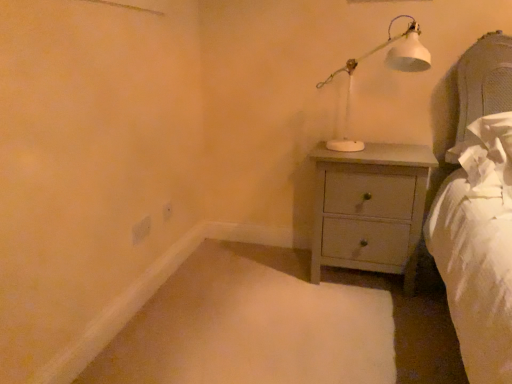
Question: From the image's perspective, is white matte table lamp at upper right beneath white plastic electric outlet at lower center, the 1th electric outlet from the back?

Choices:
 (A) no
 (B) yes

Answer: (A)

Question: Is white plastic electric outlet at lower center, the 1th electric outlet from the back, completely or partially inside white matte table lamp at upper right?

Choices:
 (A) no
 (B) yes

Answer: (A)

Question: Is white matte table lamp at upper right shorter than white plastic electric outlet at lower center, the 1th electric outlet viewed from the right?

Choices:
 (A) yes
 (B) no

Answer: (B)

Question: From a real-world perspective, is white matte table lamp at upper right positioned over white plastic electric outlet at lower center, the 1th electric outlet viewed from the right, based on gravity?

Choices:
 (A) no
 (B) yes

Answer: (B)

Question: Is white matte table lamp at upper right further to camera compared to white plastic electric outlet at lower center, the 1th electric outlet from the back?

Choices:
 (A) no
 (B) yes

Answer: (A)

Question: Does white matte table lamp at upper right have a lesser width compared to white plastic electric outlet at lower center, which is the second electric outlet in front-to-back order?

Choices:
 (A) yes
 (B) no

Answer: (B)

Question: Is light gray wood chest of drawers at center-right far away from white matte electric outlet at lower left, acting as the second electric outlet starting from the right?

Choices:
 (A) no
 (B) yes

Answer: (B)

Question: Considering the relative sizes of light gray wood chest of drawers at center-right and white matte electric outlet at lower left, acting as the second electric outlet starting from the right, in the image provided, is light gray wood chest of drawers at center-right shorter than white matte electric outlet at lower left, acting as the second electric outlet starting from the right,?

Choices:
 (A) no
 (B) yes

Answer: (A)

Question: From the image's perspective, is light gray wood chest of drawers at center-right located above white matte electric outlet at lower left, acting as the first electric outlet starting from the front?

Choices:
 (A) yes
 (B) no

Answer: (A)

Question: Does light gray wood chest of drawers at center-right have a smaller size compared to white matte electric outlet at lower left, marked as the second electric outlet in a back-to-front arrangement?

Choices:
 (A) no
 (B) yes

Answer: (A)

Question: From a real-world perspective, is light gray wood chest of drawers at center-right physically below white matte electric outlet at lower left, which is counted as the first electric outlet, starting from the left?

Choices:
 (A) yes
 (B) no

Answer: (A)

Question: Can you confirm if light gray wood chest of drawers at center-right is bigger than white matte electric outlet at lower left, which is counted as the first electric outlet, starting from the left?

Choices:
 (A) yes
 (B) no

Answer: (A)

Question: Is white matte table lamp at upper right surrounded by white matte electric outlet at lower left, acting as the first electric outlet starting from the front?

Choices:
 (A) yes
 (B) no

Answer: (B)